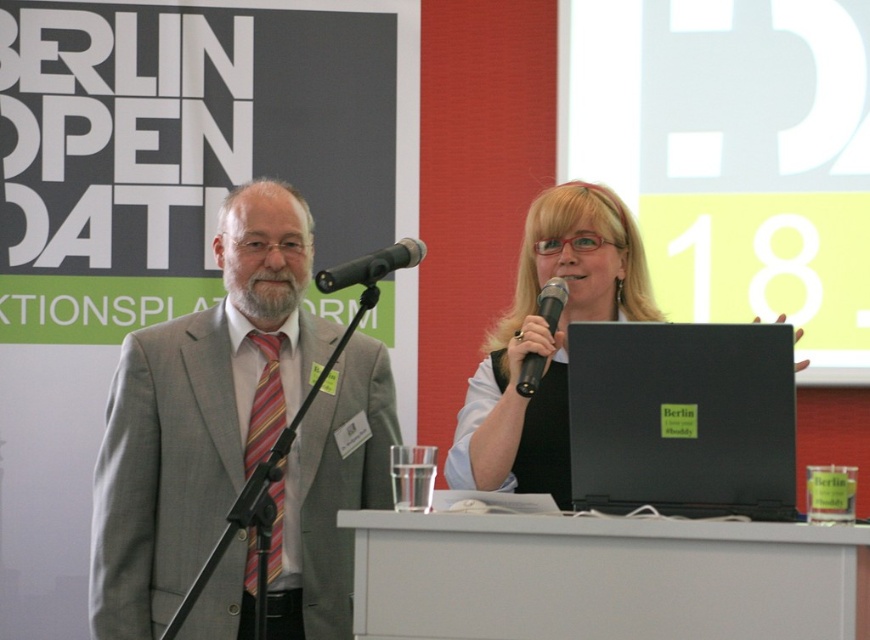
Question: Can you confirm if striped fabric tie at left is positioned to the right of black metallic microphone at center?

Choices:
 (A) yes
 (B) no

Answer: (B)

Question: Which object is the closest to the black metallic microphone at center?

Choices:
 (A) gray suit at left
 (B) striped fabric tie at left
 (C) matte black laptop at center
 (D) black plastic microphone at upper center

Answer: (D)

Question: Which of these objects is positioned closest to the striped fabric tie at left?

Choices:
 (A) gray suit at left
 (B) black metallic microphone at center

Answer: (A)

Question: Is gray suit at left positioned before matte black laptop at center?

Choices:
 (A) no
 (B) yes

Answer: (A)

Question: Which of the following is the farthest from the observer?

Choices:
 (A) (533, 371)
 (B) (412, 252)
 (C) (325, 436)

Answer: (C)

Question: Is black metallic microphone at center bigger than black plastic microphone at upper center?

Choices:
 (A) yes
 (B) no

Answer: (B)